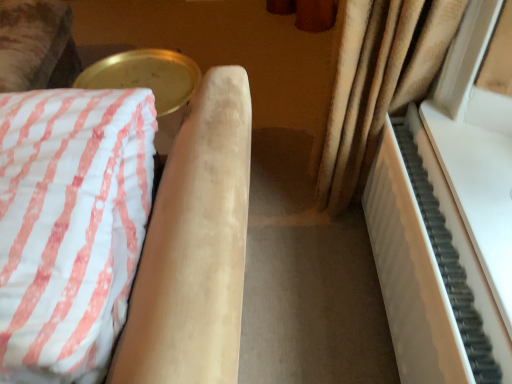
This screenshot has width=512, height=384. I want to click on free space that is in between velvet beige armchair at left and white matte piano at right, so click(307, 235).